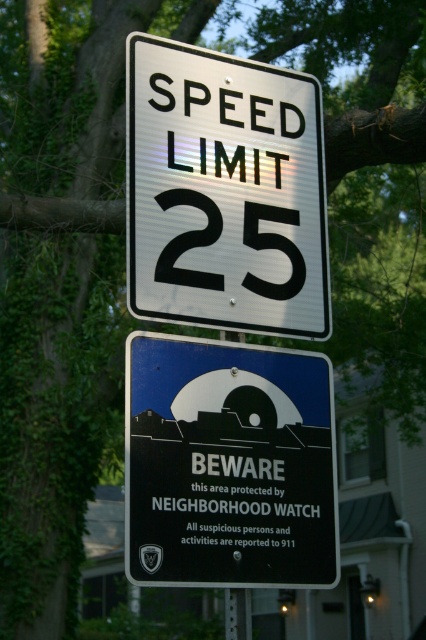
Question: Is white metallic speed limit sign at upper center bigger than metallic blue sign at center?

Choices:
 (A) yes
 (B) no

Answer: (A)

Question: Where is metallic blue sign at center located in relation to blackmaterial/texturebeware sign at center in the image?

Choices:
 (A) below
 (B) above

Answer: (B)

Question: Estimate the real-world distances between objects in this image. Which object is closer to the metallic blue sign at center?

Choices:
 (A) white metallic speed limit sign at upper center
 (B) blackmaterial/texturebeware sign at center

Answer: (B)

Question: Which point appears closest to the camera in this image?

Choices:
 (A) (213, 355)
 (B) (195, 60)

Answer: (A)

Question: Is white metallic speed limit sign at upper center closer to camera compared to metallic blue sign at center?

Choices:
 (A) no
 (B) yes

Answer: (A)

Question: Among these objects, which one is farthest from the camera?

Choices:
 (A) white metallic speed limit sign at upper center
 (B) blackmaterial/texturebeware sign at center

Answer: (A)